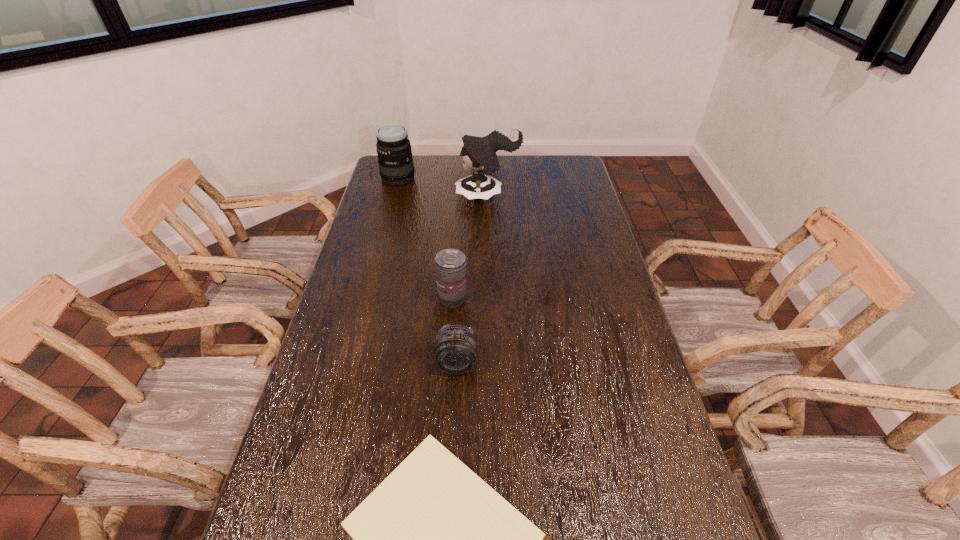
Where is `vacant space located on the back of the tallest telephoto lens`? This screenshot has width=960, height=540. vacant space located on the back of the tallest telephoto lens is located at coordinates (403, 160).

The width and height of the screenshot is (960, 540). I want to click on free point located 0.210m on the side of the third nearest object where the control switches are located, so click(x=532, y=299).

Locate an element on the screen. free space located at the front element of the nearest telephoto lens is located at coordinates (453, 447).

Find the location of a particular element. object that is positioned at the far edge is located at coordinates tap(396, 167).

Image resolution: width=960 pixels, height=540 pixels. I want to click on object located in the left edge section of the desktop, so click(x=396, y=167).

The height and width of the screenshot is (540, 960). I want to click on object positioned at the far left corner, so click(396, 167).

Image resolution: width=960 pixels, height=540 pixels. I want to click on vacant space at the far edge of the desktop, so click(x=535, y=178).

In the image, there is a desktop. At what (x,y) coordinates should I click in order to perform the action: click on vacant space at the left edge. Please return your answer as a coordinate pair (x, y). Looking at the image, I should click on (348, 292).

You are a GUI agent. You are given a task and a screenshot of the screen. Output one action in this format:
    pyautogui.click(x=<x>, y=<y>)
    Task: Click on the vacant space at the right edge of the desktop
    
    Given the screenshot: What is the action you would take?
    pyautogui.click(x=579, y=303)

Locate an element on the screen. vacant space at the far right corner is located at coordinates (549, 168).